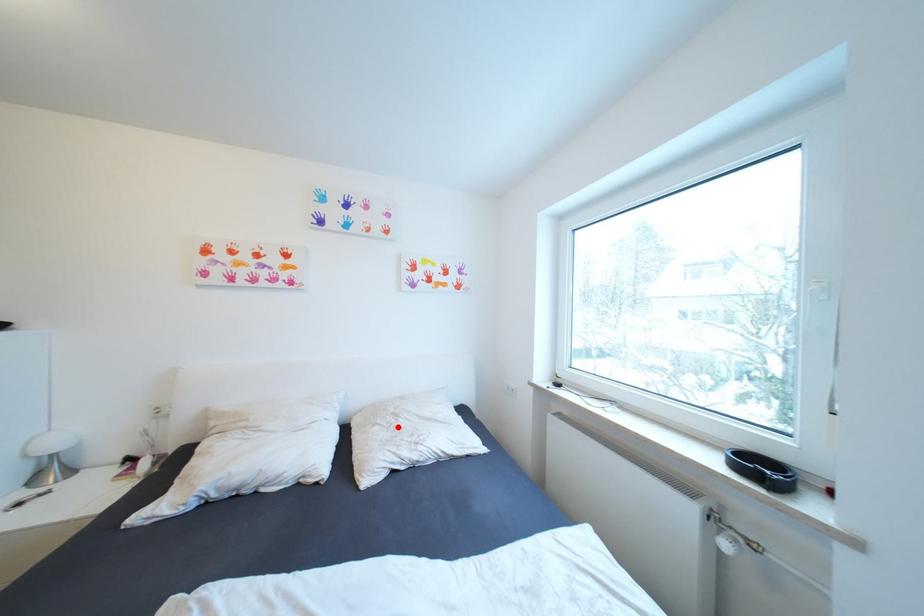
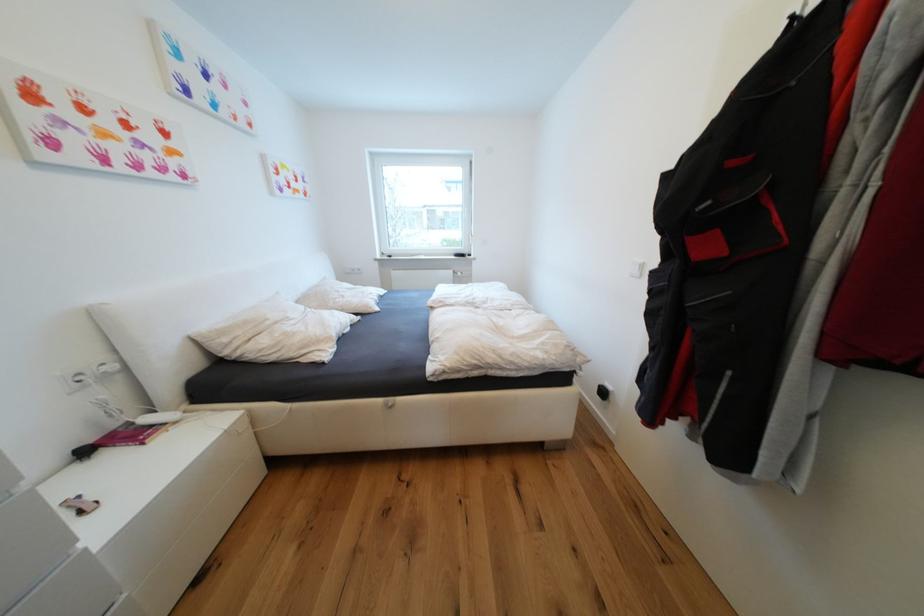
Question: I am providing you with two images of the same scene from different viewpoints. In image1, a red point is highlighted. Considering the same 3D point in image2, which of the following is correct?

Choices:
 (A) It is closer
 (B) It is farther

Answer: (A)